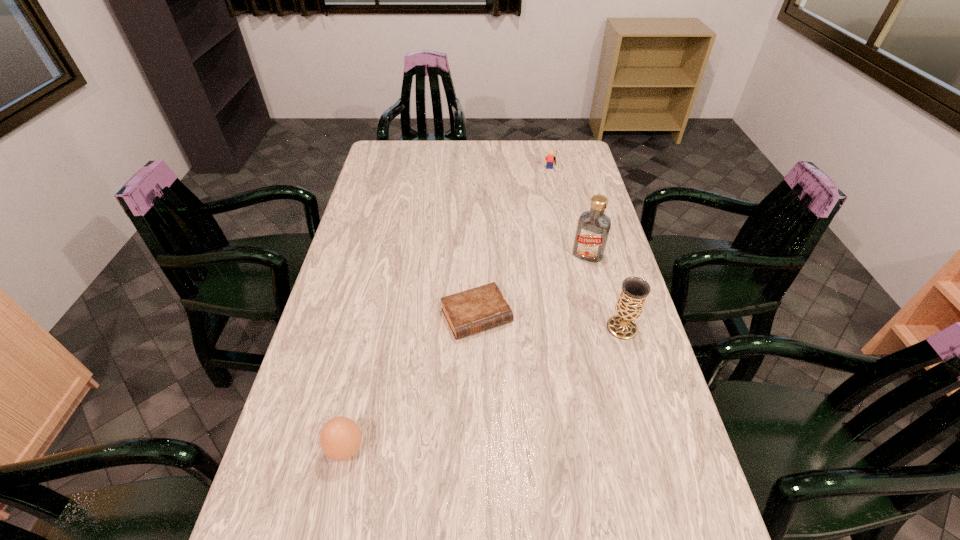
Identify the location of vacant space on the desktop that is between the boiled egg and the chalice and is positioned on the spine side of the diary. This screenshot has width=960, height=540. 509,377.

The width and height of the screenshot is (960, 540). I want to click on vacant space on the desktop that is between the leftmost object and the chalice and is positioned on the front-facing side of the tallest object, so click(x=535, y=366).

Where is `vacant spot on the desktop that is between the nearest object and the chalice and is positioned on the front-facing side of the Lego`? vacant spot on the desktop that is between the nearest object and the chalice and is positioned on the front-facing side of the Lego is located at coordinates (523, 372).